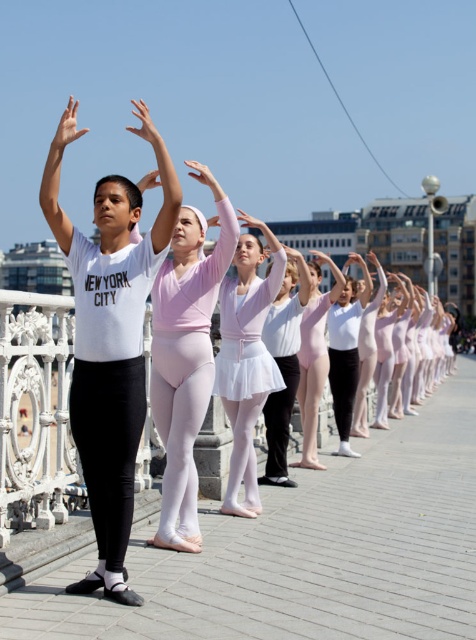
Based on the photo, you are a photographer trying to capture the dancers in the scene. You notice the black leggings at center and the matte white arm at upper center. Which object appears taller in the photo?

The matte white arm at upper center appears taller than the black leggings at center in the photo.

You are a photographer capturing the ballet practice session. You need to adjust your camera focus to ensure both the black leggings at center and the matte white arm at upper center are in sharp focus. Based on their positions, which object should you focus on first to ensure both are in focus?

You should focus on the matte white arm at upper center first because the black leggings at center is to the right of it, and focusing on the closer object ensures both will be in focus.

Based on the photo, you are a photographer standing on the bridge where the dancers are practicing. You want to capture a photo that includes both the black leggings at center and the matte white arm at upper center. Given that your camera has a maximum focus range of 7 feet, will you be able to get both subjects in focus at the same time?

The black leggings at center and the matte white arm at upper center are 7.48 feet apart from each other. Since the camera can only focus within 7 feet, the distance between them exceeds the focus range. Therefore, you cannot get both subjects in focus simultaneously.